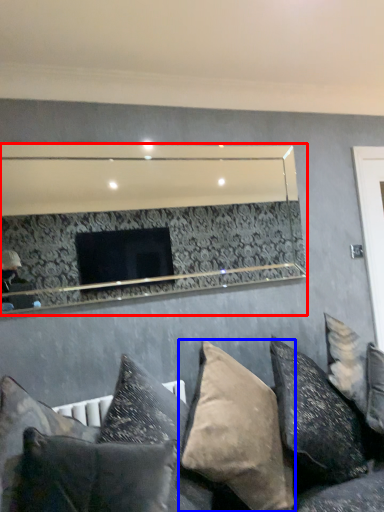
Question: Which object appears closest to the camera in this image, mirror (highlighted by a red box) or pillow (highlighted by a blue box)?

Choices:
 (A) mirror
 (B) pillow

Answer: (B)